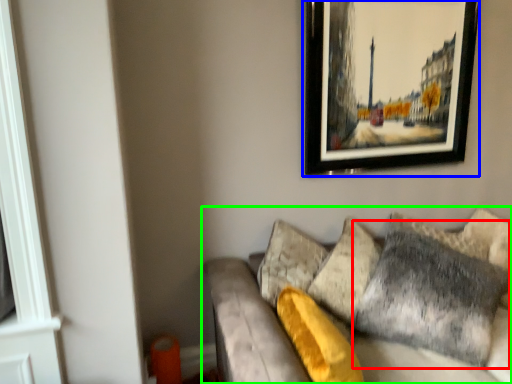
Question: Based on their relative distances, which object is nearer to pillow (highlighted by a red box)? Choose from picture frame (highlighted by a blue box) and studio couch (highlighted by a green box).

Choices:
 (A) picture frame
 (B) studio couch

Answer: (B)